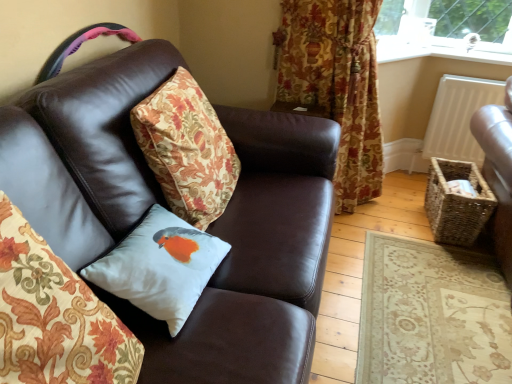
Question: Would you say white matte radiator at upper right is outside floral fabric curtain at upper right?

Choices:
 (A) no
 (B) yes

Answer: (B)

Question: Is white matte radiator at upper right shorter than floral fabric curtain at upper right?

Choices:
 (A) yes
 (B) no

Answer: (A)

Question: Is white matte radiator at upper right closer to the viewer compared to floral fabric curtain at upper right?

Choices:
 (A) no
 (B) yes

Answer: (A)

Question: From a real-world perspective, is white matte radiator at upper right below floral fabric curtain at upper right?

Choices:
 (A) no
 (B) yes

Answer: (B)

Question: From the image's perspective, would you say white matte radiator at upper right is positioned over floral fabric curtain at upper right?

Choices:
 (A) yes
 (B) no

Answer: (B)

Question: From a real-world perspective, is white matte radiator at upper right above or below brown leather couch at center?

Choices:
 (A) below
 (B) above

Answer: (A)

Question: Is white matte radiator at upper right spatially inside brown leather couch at center, or outside of it?

Choices:
 (A) outside
 (B) inside

Answer: (A)

Question: In terms of height, does white matte radiator at upper right look taller or shorter compared to brown leather couch at center?

Choices:
 (A) tall
 (B) short

Answer: (B)

Question: Is point (438, 139) positioned closer to the camera than point (73, 117)?

Choices:
 (A) closer
 (B) farther

Answer: (B)

Question: From a real-world perspective, is brown leather couch at center physically located above or below white matte radiator at upper right?

Choices:
 (A) below
 (B) above

Answer: (B)

Question: Considering their positions, is brown leather couch at center located in front of or behind white matte radiator at upper right?

Choices:
 (A) behind
 (B) front

Answer: (B)

Question: Considering the positions of brown leather couch at center and white matte radiator at upper right in the image, is brown leather couch at center bigger or smaller than white matte radiator at upper right?

Choices:
 (A) big
 (B) small

Answer: (A)

Question: Considering the positions of brown leather couch at center and white matte radiator at upper right in the image, is brown leather couch at center wider or thinner than white matte radiator at upper right?

Choices:
 (A) wide
 (B) thin

Answer: (A)

Question: Is floral fabric curtain at upper right taller or shorter than white satin cushion at center, placed as the second pillow when sorted from back to front?

Choices:
 (A) tall
 (B) short

Answer: (A)

Question: In terms of width, does floral fabric curtain at upper right look wider or thinner when compared to white satin cushion at center, placed as the second pillow when sorted from back to front?

Choices:
 (A) wide
 (B) thin

Answer: (A)